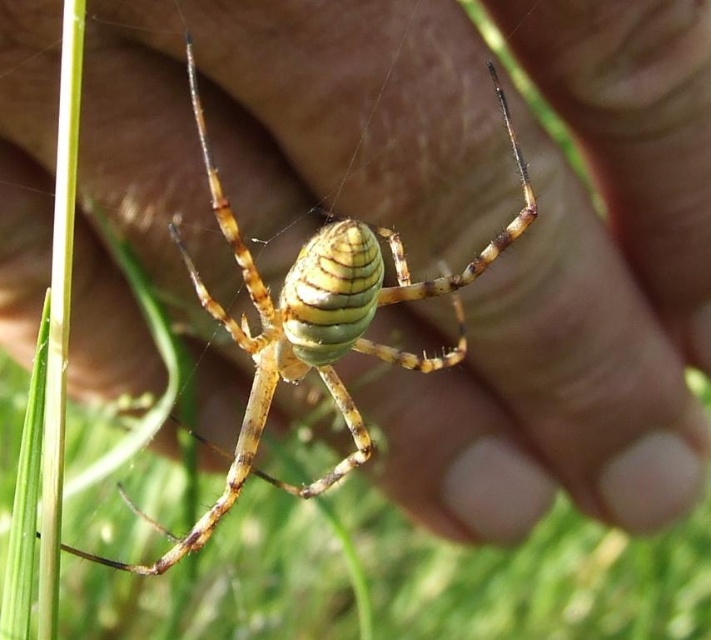
Question: Considering the relative positions of green grass at center and yellow striped spider at center in the image provided, where is green grass at center located with respect to yellow striped spider at center?

Choices:
 (A) right
 (B) left

Answer: (A)

Question: Which of the following is the closest to the observer?

Choices:
 (A) green grass at center
 (B) yellow striped spider at center

Answer: (B)

Question: Is green grass at center bigger than yellow striped spider at center?

Choices:
 (A) no
 (B) yes

Answer: (B)

Question: From the image, what is the correct spatial relationship of green grass at center in relation to yellow striped spider at center?

Choices:
 (A) left
 (B) right

Answer: (B)

Question: Which point is farther to the camera?

Choices:
 (A) (247, 259)
 (B) (673, 538)

Answer: (B)